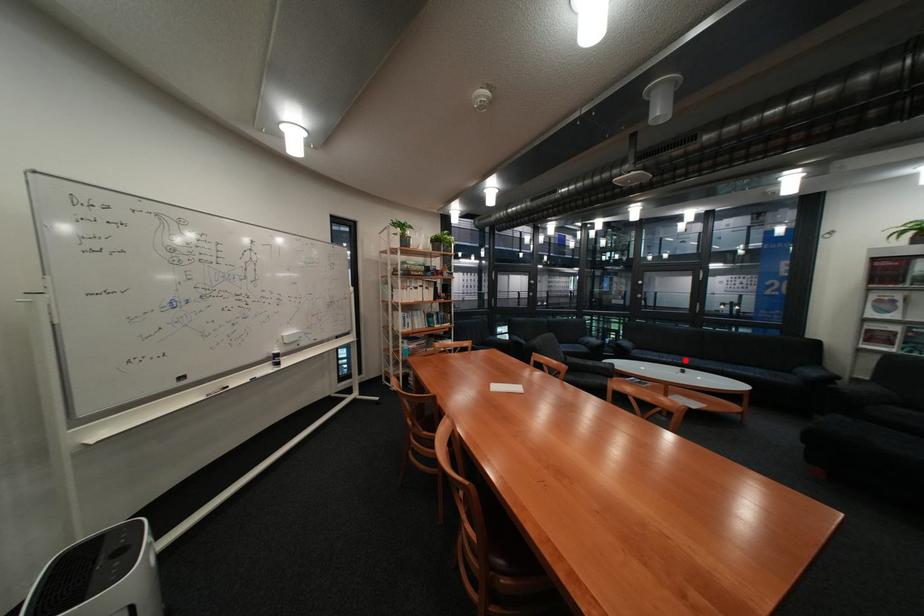
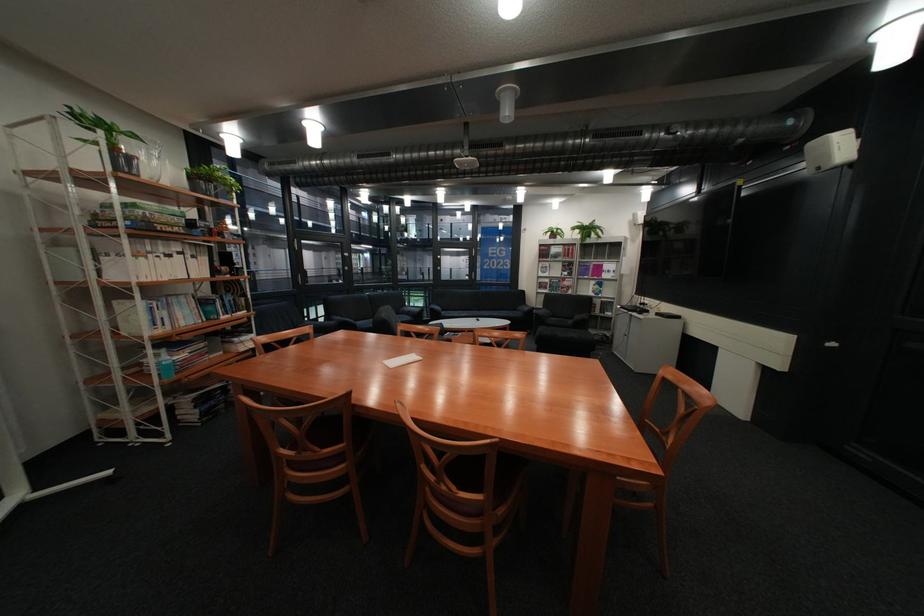
In the second image, find the point that corresponds to the highlighted location in the first image.

(481, 315)